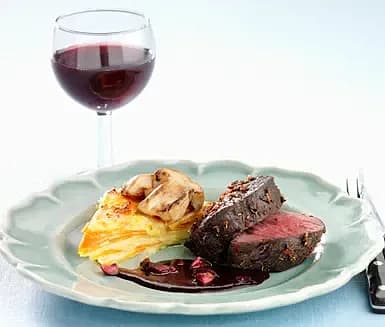
In order to click on utensil in this screenshot , I will do `click(380, 279)`.